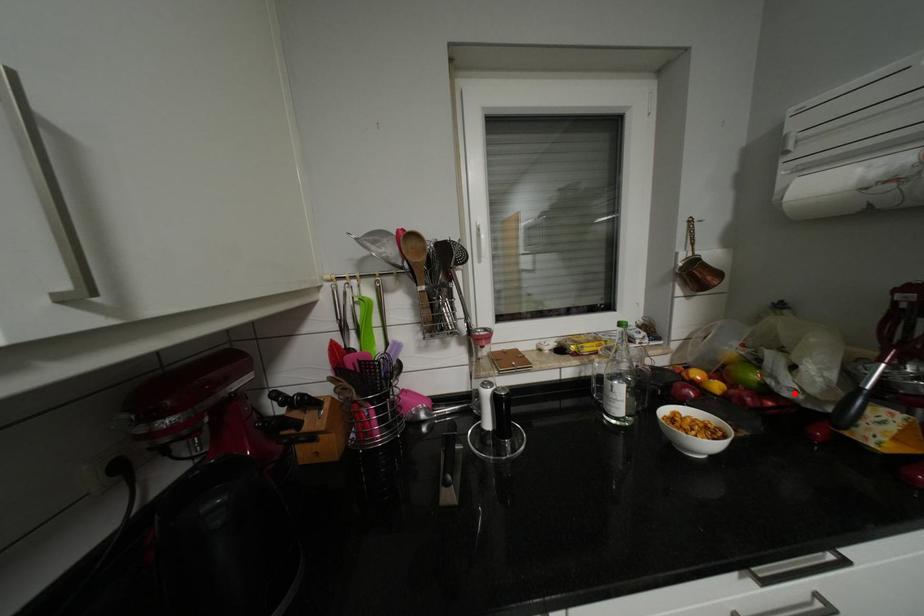
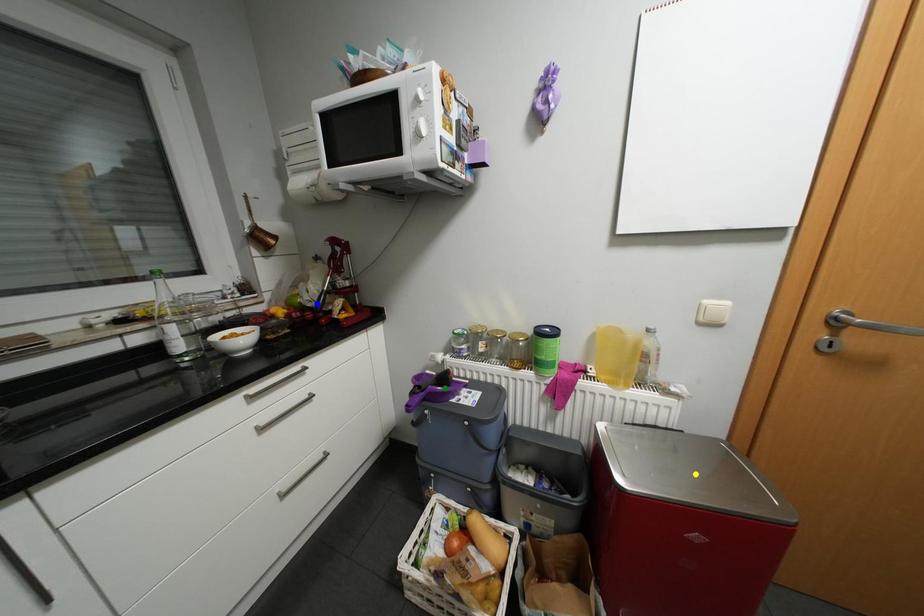
Question: I am providing you with two images of the same scene from different viewpoints. A red point is marked on the first image. You are given multiple points on the second image. Which point in image 2 represents the same 3d spot as the red point in image 1?

Choices:
 (A) green point
 (B) blue point
 (C) yellow point

Answer: (B)